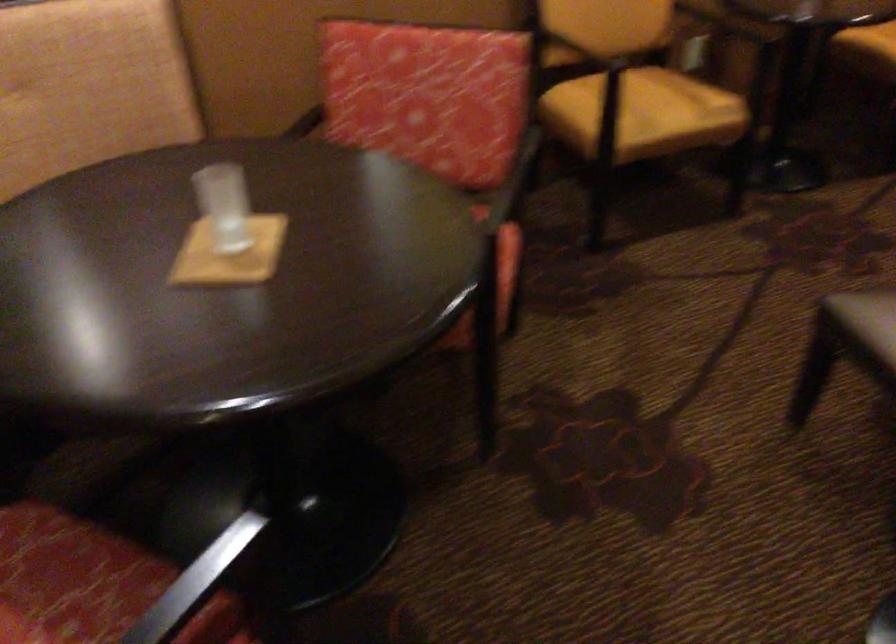
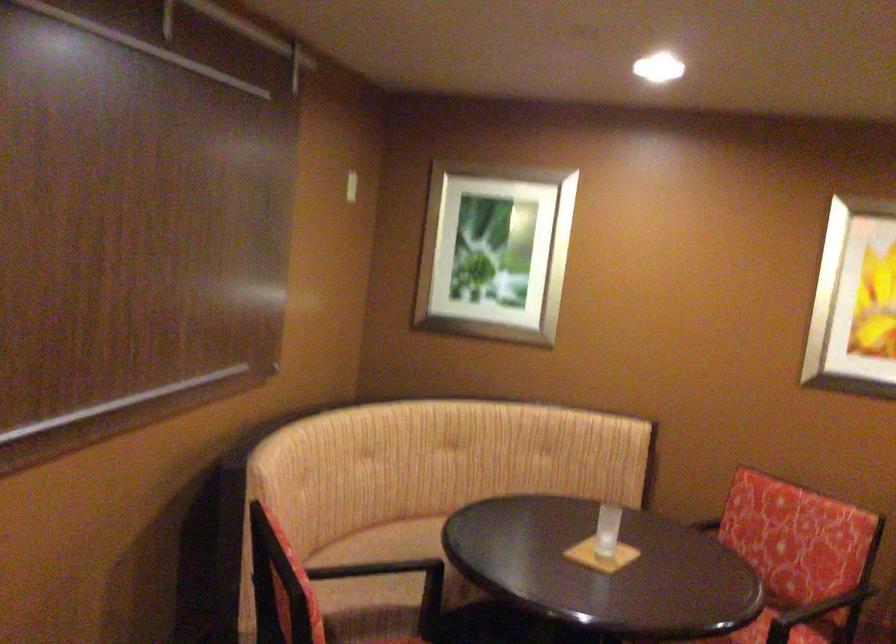
The images are taken continuously from a first-person perspective. In which direction is your viewpoint rotating?

The camera rotated toward left-up.